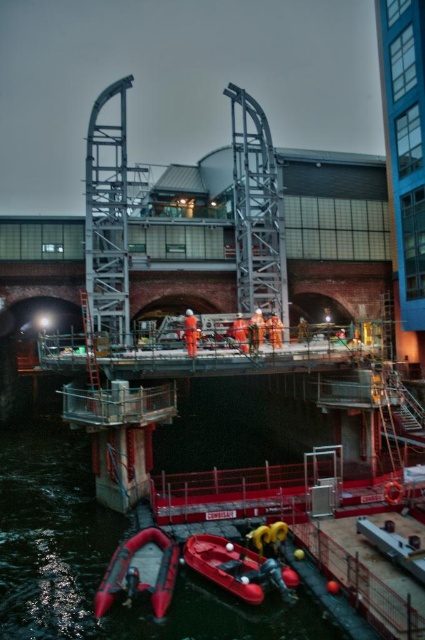
Question: Does rubberized red inflatable boat at lower left have a larger size compared to orange reflective safety suit at center?

Choices:
 (A) no
 (B) yes

Answer: (A)

Question: Which of the following is the closest to the observer?

Choices:
 (A) (187, 321)
 (B) (61, 497)
 (C) (257, 588)

Answer: (C)

Question: Is the position of rubberized red inflatable boat at lower left less distant than that of rubberized red inflatable boat at lower center?

Choices:
 (A) yes
 (B) no

Answer: (B)

Question: In this image, where is rubberized red inflatable boat at lower left located relative to rubberized red inflatable boat at lower center?

Choices:
 (A) above
 (B) below

Answer: (B)

Question: Which of the following is the closest to the observer?

Choices:
 (A) rubber boat at lower center
 (B) rubberized red inflatable boat at lower left

Answer: (A)

Question: Which object is the closest to the orange reflective safety suit at center?

Choices:
 (A) rubber boat at lower center
 (B) rubberized red inflatable boat at lower left
 (C) rubberized red inflatable boat at lower center

Answer: (B)